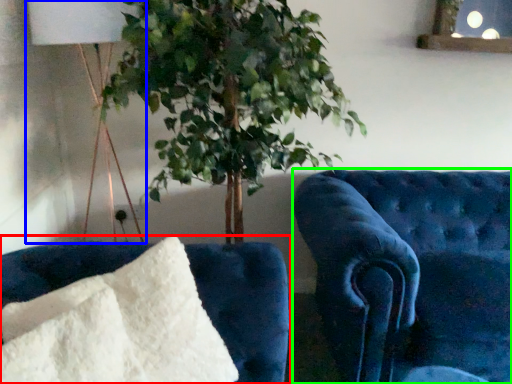
Question: Based on their relative distances, which object is nearer to furniture (highlighted by a red box)? Choose from table lamp (highlighted by a blue box) and furniture (highlighted by a green box).

Choices:
 (A) table lamp
 (B) furniture

Answer: (B)